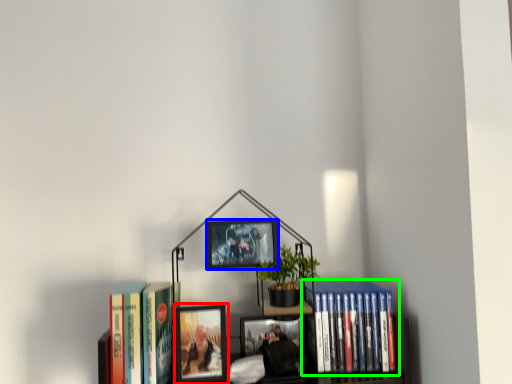
Question: Which is nearer to the picture frame (highlighted by a red box)? picture frame (highlighted by a blue box) or book (highlighted by a green box).

Choices:
 (A) picture frame
 (B) book

Answer: (A)